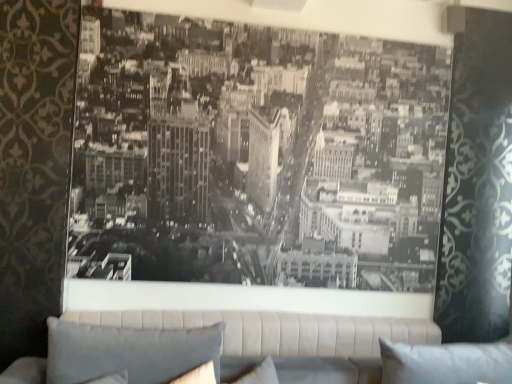
Question: From the image's perspective, is gray fabric pillow at lower left, which is the first pillow from left to right, beneath white fabric pillow at lower right, which appears as the 1th pillow when viewed from the right?

Choices:
 (A) no
 (B) yes

Answer: (A)

Question: Is gray fabric pillow at lower left, the 2th pillow when ordered from right to left, far from white fabric pillow at lower right, which appears as the 1th pillow when viewed from the right?

Choices:
 (A) no
 (B) yes

Answer: (B)

Question: Is gray fabric pillow at lower left, which is the first pillow from left to right, not inside white fabric pillow at lower right, which appears as the 1th pillow when viewed from the right?

Choices:
 (A) no
 (B) yes

Answer: (B)

Question: Considering the relative sizes of gray fabric pillow at lower left, which is the first pillow from left to right, and white fabric pillow at lower right, which is the second pillow from left to right, in the image provided, is gray fabric pillow at lower left, which is the first pillow from left to right, shorter than white fabric pillow at lower right, which is the second pillow from left to right,?

Choices:
 (A) yes
 (B) no

Answer: (B)

Question: Can you confirm if gray fabric pillow at lower left, which is the first pillow from left to right, is positioned to the right of white fabric pillow at lower right, which is the second pillow from left to right?

Choices:
 (A) yes
 (B) no

Answer: (B)

Question: Can you confirm if gray fabric pillow at lower left, the 2th pillow when ordered from right to left, is smaller than white fabric pillow at lower right, which is the second pillow from left to right?

Choices:
 (A) no
 (B) yes

Answer: (A)

Question: Does beige fabric studio couch at center come in front of white fabric pillow at lower right, which is the second pillow from left to right?

Choices:
 (A) no
 (B) yes

Answer: (A)

Question: Is beige fabric studio couch at center not near white fabric pillow at lower right, which appears as the 1th pillow when viewed from the right?

Choices:
 (A) no
 (B) yes

Answer: (A)

Question: Is beige fabric studio couch at center positioned with its back to white fabric pillow at lower right, which appears as the 1th pillow when viewed from the right?

Choices:
 (A) no
 (B) yes

Answer: (A)

Question: Is beige fabric studio couch at center thinner than white fabric pillow at lower right, which is the second pillow from left to right?

Choices:
 (A) yes
 (B) no

Answer: (A)

Question: Does beige fabric studio couch at center appear on the right side of white fabric pillow at lower right, which is the second pillow from left to right?

Choices:
 (A) yes
 (B) no

Answer: (B)

Question: From the image's perspective, would you say beige fabric studio couch at center is positioned over white fabric pillow at lower right, which is the second pillow from left to right?

Choices:
 (A) no
 (B) yes

Answer: (A)

Question: Is white fabric pillow at lower right, which appears as the 1th pillow when viewed from the right, bigger than beige fabric studio couch at center?

Choices:
 (A) no
 (B) yes

Answer: (A)